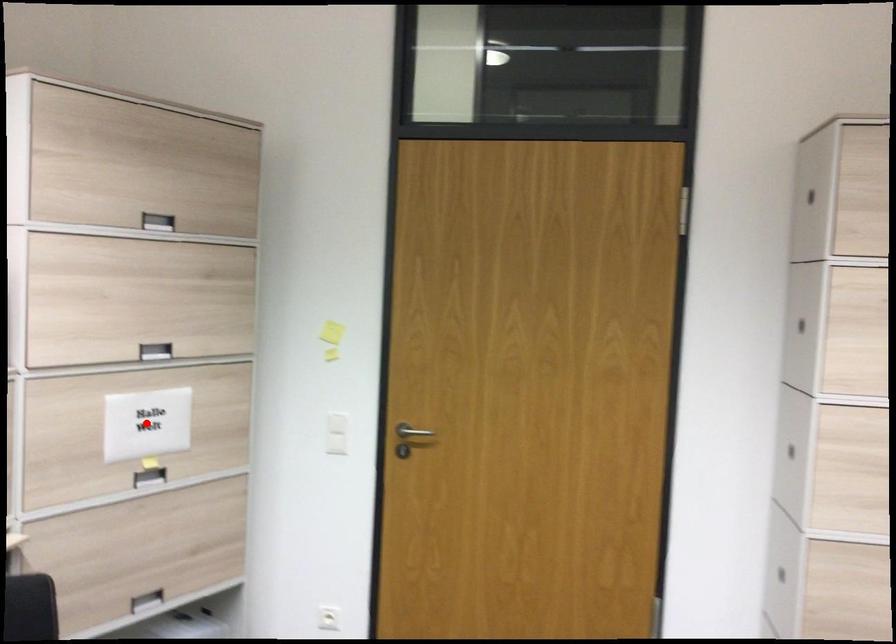
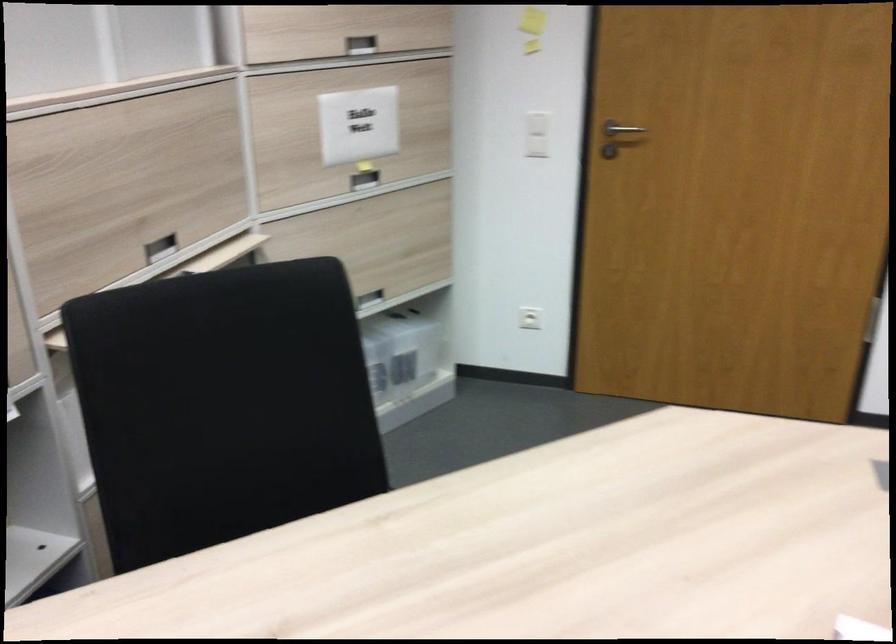
In the second image, find the point that corresponds to the highlighted location in the first image.

(358, 125)